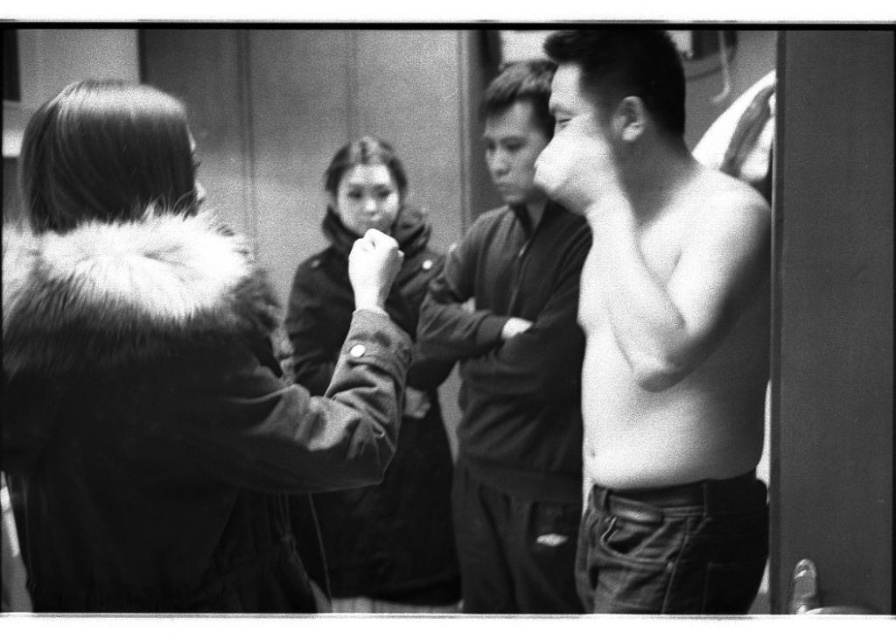
Question: Is fur-lined coat at left below smooth skin torso at center?

Choices:
 (A) yes
 (B) no

Answer: (A)

Question: Which object appears farthest from the camera in this image?

Choices:
 (A) matte black jacket at center
 (B) smooth skin torso at center
 (C) smooth black shirt at center

Answer: (A)

Question: Is fur-lined coat at left bigger than matte black jacket at center?

Choices:
 (A) yes
 (B) no

Answer: (A)

Question: Among these points, which one is nearest to the camera?

Choices:
 (A) (432, 484)
 (B) (665, 470)
 (C) (143, 106)
 (D) (523, 436)

Answer: (C)

Question: Which point appears farthest from the camera in this image?

Choices:
 (A) (89, 385)
 (B) (682, 426)
 (C) (406, 577)
 (D) (509, 440)

Answer: (C)

Question: Does fur-lined coat at left lie behind smooth black shirt at center?

Choices:
 (A) no
 (B) yes

Answer: (A)